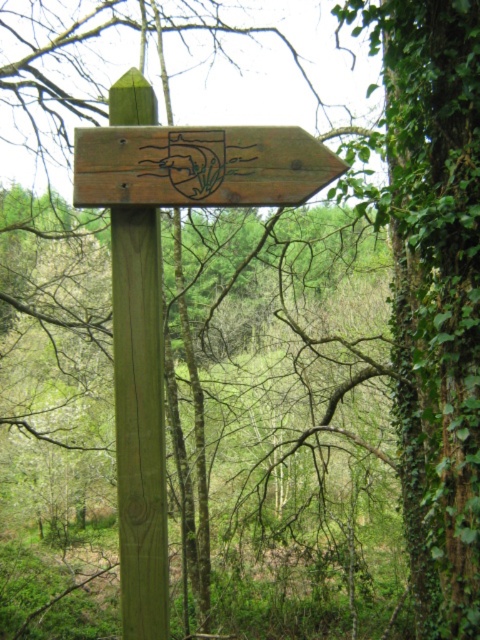
Question: Does green wood post at center appear over wooden signpost at upper center?

Choices:
 (A) yes
 (B) no

Answer: (B)

Question: Among these objects, which one is nearest to the camera?

Choices:
 (A) wooden signpost at upper center
 (B) green wood post at center

Answer: (B)

Question: Does green wood post at center appear on the right side of wooden signpost at upper center?

Choices:
 (A) no
 (B) yes

Answer: (A)

Question: In this image, where is green wood post at center located relative to wooden signpost at upper center?

Choices:
 (A) below
 (B) above

Answer: (A)

Question: Which object is closer to the camera taking this photo?

Choices:
 (A) green wood post at center
 (B) wooden signpost at upper center

Answer: (A)